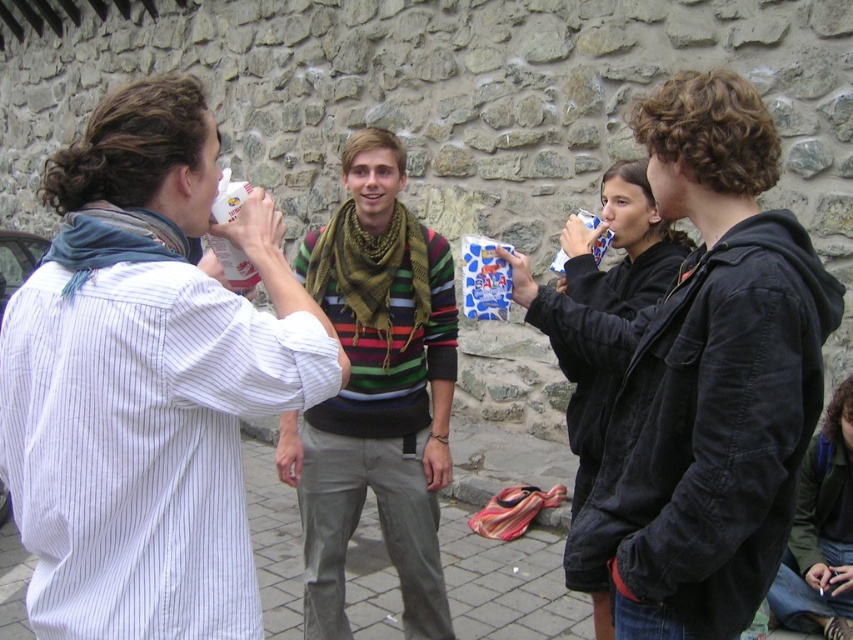
Question: Estimate the real-world distances between objects in this image. Which object is farther from the dark gray hoodie at right?

Choices:
 (A) black matte jacket at center
 (B) white striped shirt at left
 (C) dark green fabric jacket at lower right
 (D) white paper cup at upper left

Answer: (C)

Question: Is dark gray hoodie at right bigger than dark green fabric jacket at lower right?

Choices:
 (A) yes
 (B) no

Answer: (A)

Question: Does dark gray hoodie at right have a lesser width compared to dark green fabric jacket at lower right?

Choices:
 (A) yes
 (B) no

Answer: (B)

Question: Which point appears farthest from the camera in this image?

Choices:
 (A) (805, 515)
 (B) (762, 416)
 (C) (28, 465)
 (D) (309, 637)

Answer: (A)

Question: Can you confirm if white striped shirt at left is thinner than dark gray hoodie at right?

Choices:
 (A) yes
 (B) no

Answer: (B)

Question: Which object is positioned farthest from the dark gray hoodie at right?

Choices:
 (A) dark green fabric jacket at lower right
 (B) white paper cup at upper left
 (C) striped sweater at center
 (D) black matte jacket at center

Answer: (A)